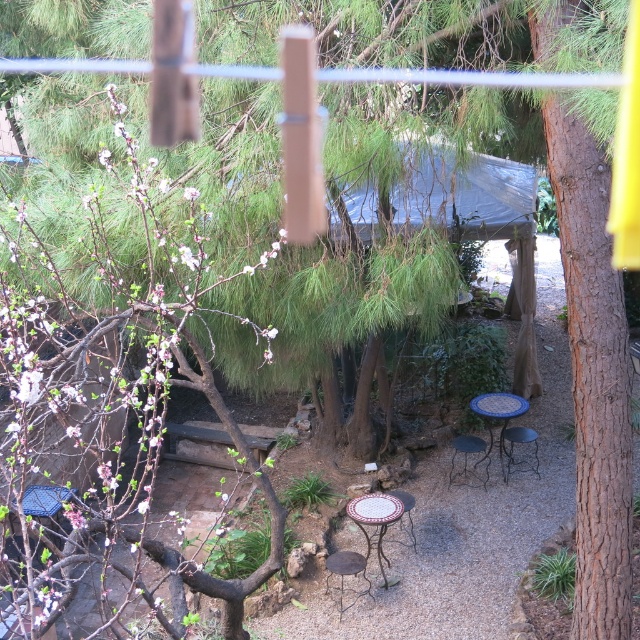
You are planning to place a decorative pot on the table that is higher up. Which table should you choose between the mosaic tile table at center and the porcelain ceramic table at center?

The porcelain ceramic table at center is higher up, so you should choose the porcelain ceramic table at center to place the decorative pot.

You are planning to place a new garden ornament between the brown rough bark tree at right and the porcelain ceramic table at center. Based on their positions, which object should you place the ornament closer to if you want it to be near the center of the garden?

The porcelain ceramic table at center is already positioned at the center of the garden, so placing the ornament closer to it would keep it near the center.